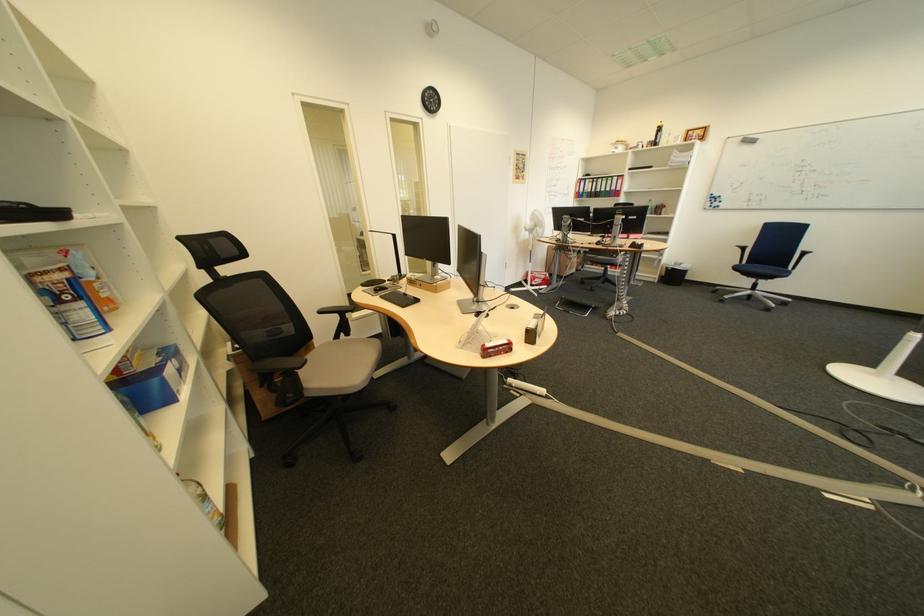
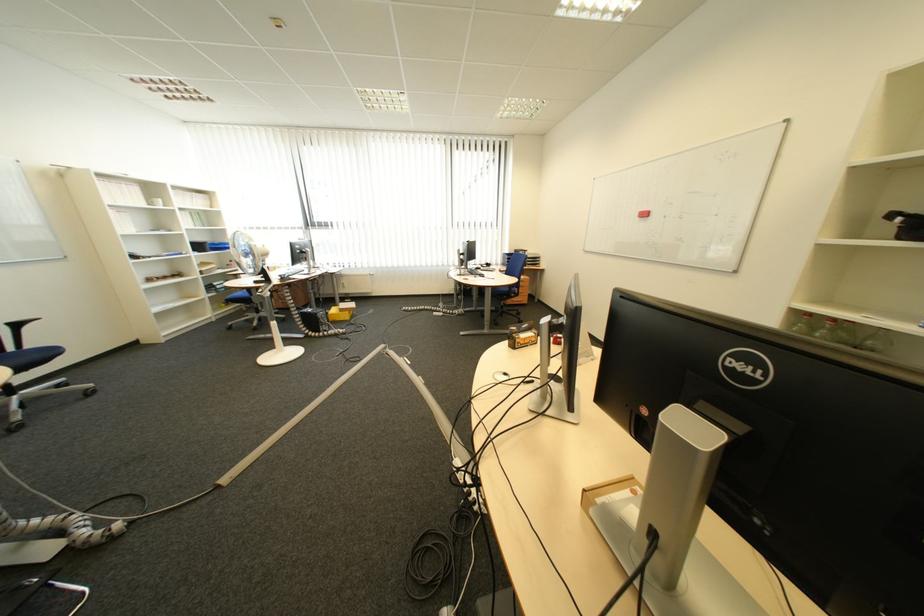
In the second image, find the point that corresponds to the point at 816,249 in the first image.

(13, 321)